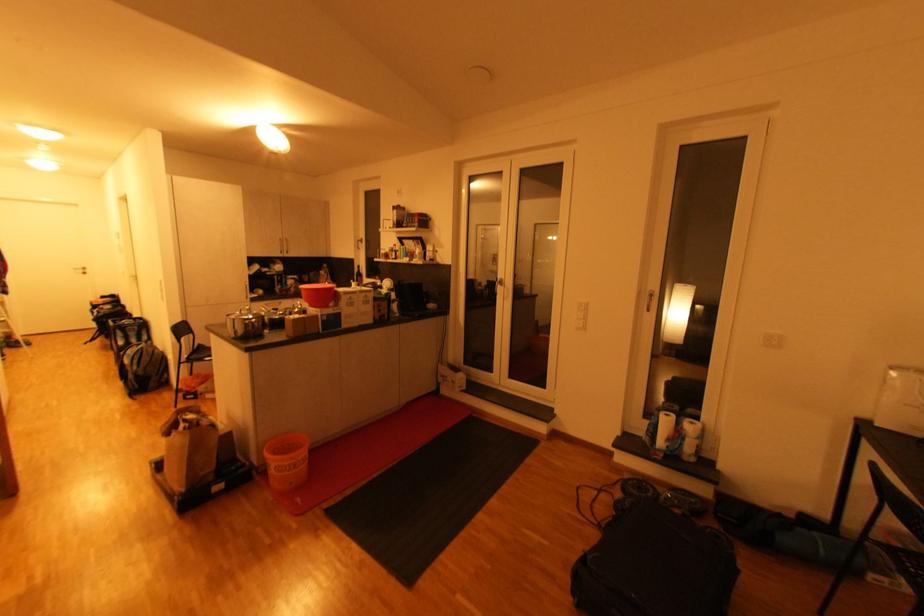
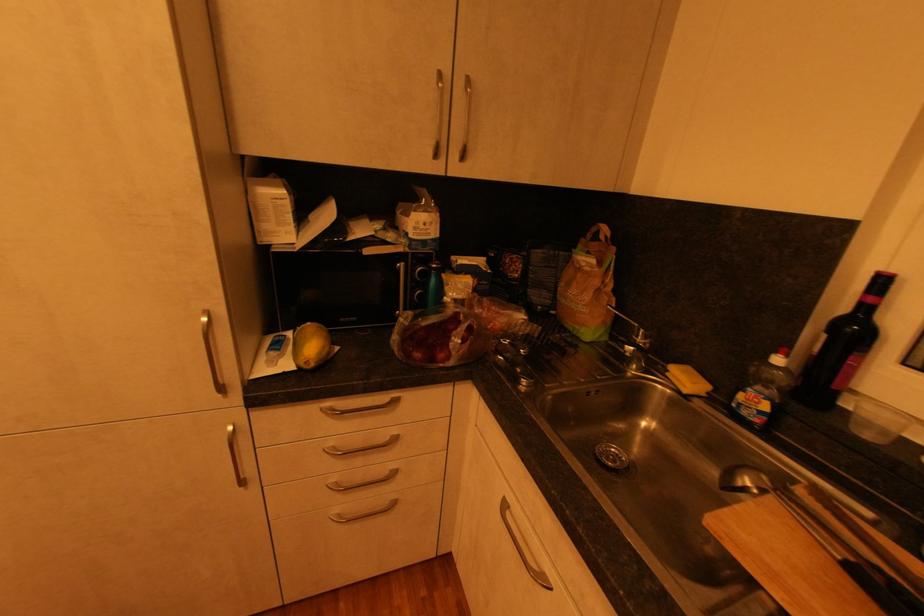
Where in the second image is the point corresponding to point 286,254 from the first image?

(441, 156)